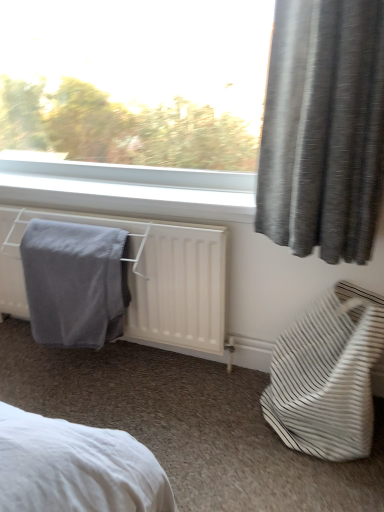
Question: From the image's perspective, does white matte radiator at lower left appear lower than gray textured curtain at upper right?

Choices:
 (A) yes
 (B) no

Answer: (A)

Question: Is white matte radiator at lower left positioned before gray textured curtain at upper right?

Choices:
 (A) yes
 (B) no

Answer: (B)

Question: Could you tell me if white matte radiator at lower left is facing gray textured curtain at upper right?

Choices:
 (A) no
 (B) yes

Answer: (A)

Question: Is there a large distance between white matte radiator at lower left and gray textured curtain at upper right?

Choices:
 (A) yes
 (B) no

Answer: (B)

Question: Is white matte radiator at lower left next to gray textured curtain at upper right and touching it?

Choices:
 (A) yes
 (B) no

Answer: (B)

Question: Does white matte radiator at lower left have a lesser width compared to gray textured curtain at upper right?

Choices:
 (A) yes
 (B) no

Answer: (B)

Question: Would you consider gray textured curtain at upper right to be distant from white matte radiator at lower left?

Choices:
 (A) yes
 (B) no

Answer: (B)

Question: Does gray textured curtain at upper right touch white matte radiator at lower left?

Choices:
 (A) yes
 (B) no

Answer: (B)

Question: Is white matte radiator at lower left inside gray textured curtain at upper right?

Choices:
 (A) no
 (B) yes

Answer: (A)

Question: Does gray textured curtain at upper right have a greater height compared to white matte radiator at lower left?

Choices:
 (A) yes
 (B) no

Answer: (A)

Question: Does gray textured curtain at upper right turn towards white matte radiator at lower left?

Choices:
 (A) no
 (B) yes

Answer: (A)

Question: From the image's perspective, does gray textured curtain at upper right appear higher than white matte radiator at lower left?

Choices:
 (A) yes
 (B) no

Answer: (A)

Question: Considering the relative sizes of white striped fabric bag at lower right and gray soft towel at lower left in the image provided, is white striped fabric bag at lower right shorter than gray soft towel at lower left?

Choices:
 (A) yes
 (B) no

Answer: (A)